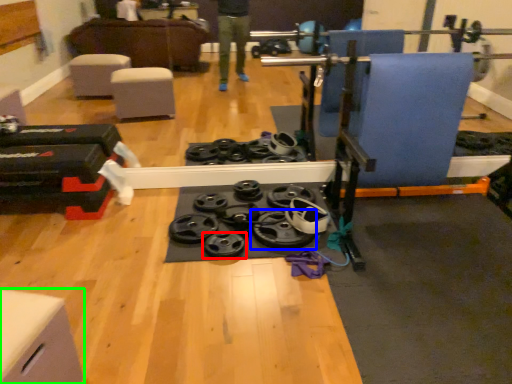
Question: Which is farther away from wheel (highlighted by a red box)? wheel (highlighted by a blue box) or furniture (highlighted by a green box)?

Choices:
 (A) wheel
 (B) furniture

Answer: (B)